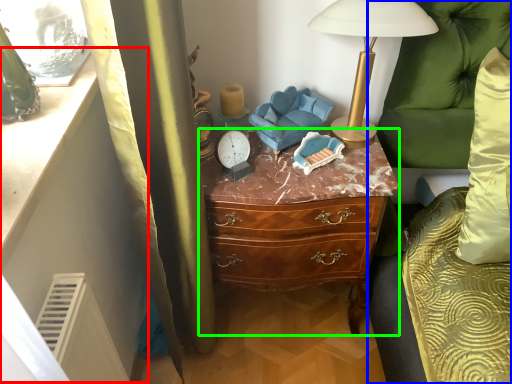
Question: Which object is the farthest from vanity (highlighted by a red box)? Choose among these: couch (highlighted by a blue box) or chest of drawers (highlighted by a green box).

Choices:
 (A) couch
 (B) chest of drawers

Answer: (A)